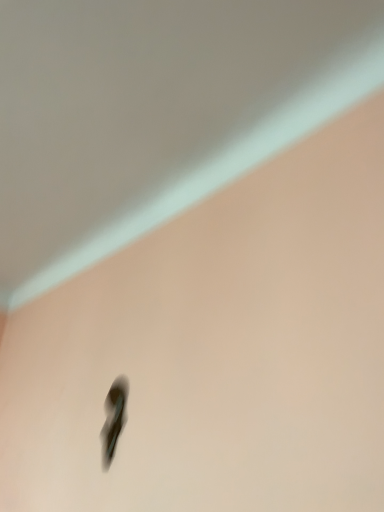
Question: Considering the positions of matte white ceiling at upper center and matte black shoe at lower left in the image, is matte white ceiling at upper center taller or shorter than matte black shoe at lower left?

Choices:
 (A) tall
 (B) short

Answer: (B)

Question: Is matte white ceiling at upper center inside the boundaries of matte black shoe at lower left, or outside?

Choices:
 (A) outside
 (B) inside

Answer: (A)

Question: From the image's perspective, is matte white ceiling at upper center located above or below matte black shoe at lower left?

Choices:
 (A) below
 (B) above

Answer: (B)

Question: From the image's perspective, is matte black shoe at lower left above or below matte white ceiling at upper center?

Choices:
 (A) below
 (B) above

Answer: (A)

Question: In terms of size, does matte black shoe at lower left appear bigger or smaller than matte white ceiling at upper center?

Choices:
 (A) small
 (B) big

Answer: (A)

Question: From a real-world perspective, is matte black shoe at lower left physically located above or below matte white ceiling at upper center?

Choices:
 (A) below
 (B) above

Answer: (A)

Question: Considering their positions, is matte black shoe at lower left located in front of or behind matte white ceiling at upper center?

Choices:
 (A) front
 (B) behind

Answer: (B)